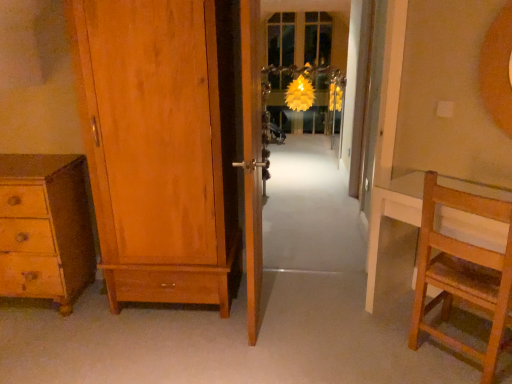
Identify the location of vacant area that lies to the right of matte wood wardrobe at left, which appears as the 2th door when viewed from the right. This screenshot has height=384, width=512. 292,314.